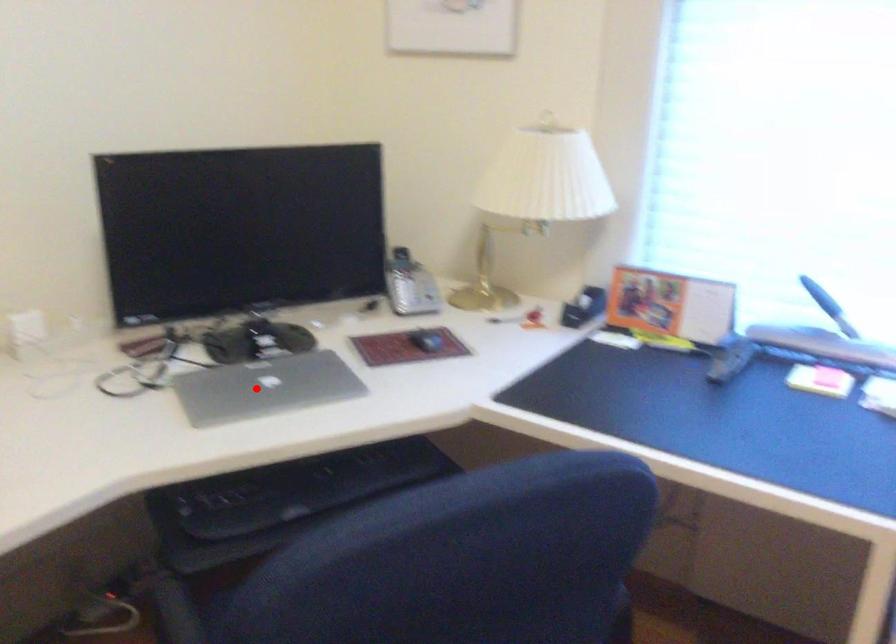
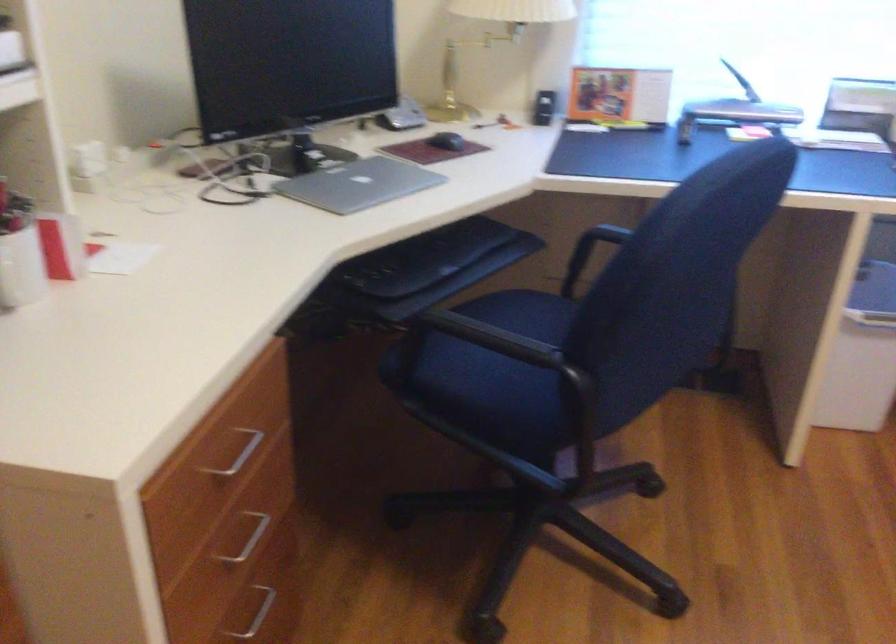
Question: A red point is marked in image1. In image2, is the corresponding 3D point closer to the camera or farther? Reply with the corresponding letter.

Choices:
 (A) The corresponding 3D point is closer.
 (B) The corresponding 3D point is farther.

Answer: (B)